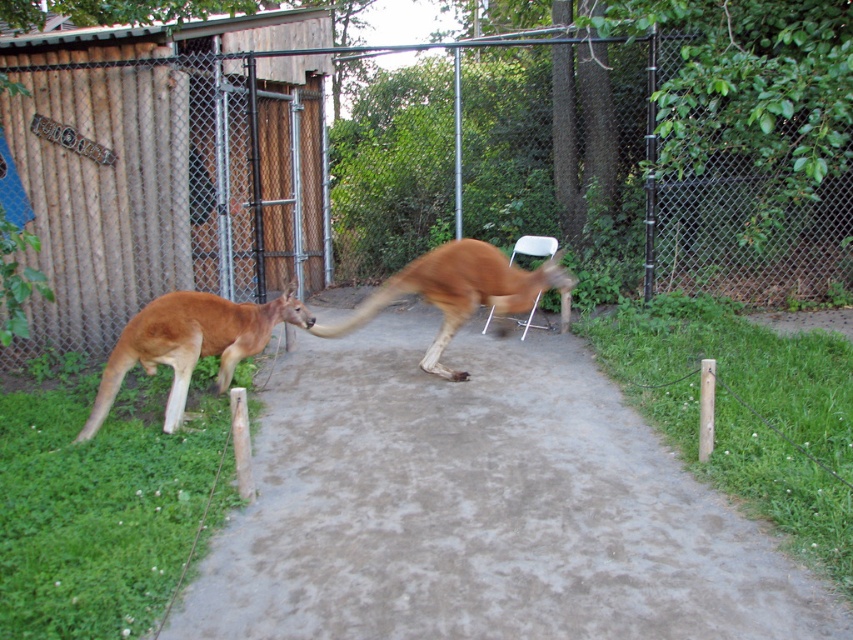
Who is taller, brown furry kangaroo at left or brown furry kangaroo at center?

brown furry kangaroo at center is taller.

Who is higher up, brown furry kangaroo at left or brown furry kangaroo at center?

Positioned higher is brown furry kangaroo at center.

Does point (100, 385) come farther from viewer compared to point (457, 252)?

No, (100, 385) is closer to viewer.

Image resolution: width=853 pixels, height=640 pixels. Identify the location of brown furry kangaroo at left. (190, 342).

Identify the location of metallic chain-link fence at center. The image size is (853, 640). (202, 184).

The width and height of the screenshot is (853, 640). In order to click on metallic chain-link fence at center in this screenshot , I will do `click(202, 184)`.

Does brown concrete pavement at center appear on the right side of brown furry kangaroo at center?

No, brown concrete pavement at center is not to the right of brown furry kangaroo at center.

Between point (515, 340) and point (384, 280), which one is positioned in front?

Positioned in front is point (515, 340).

Is point (428, 474) closer to viewer compared to point (428, 291)?

Yes, it is.

You are a GUI agent. You are given a task and a screenshot of the screen. Output one action in this format:
    pyautogui.click(x=<x>, y=<y>)
    Task: Click on the brown concrete pavement at center
    
    Given the screenshot: What is the action you would take?
    pyautogui.click(x=480, y=508)